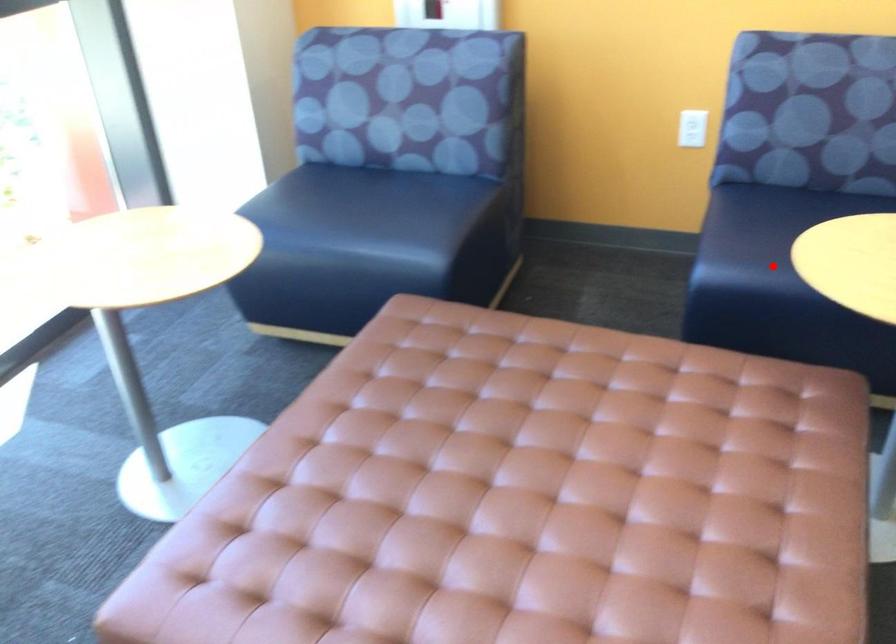
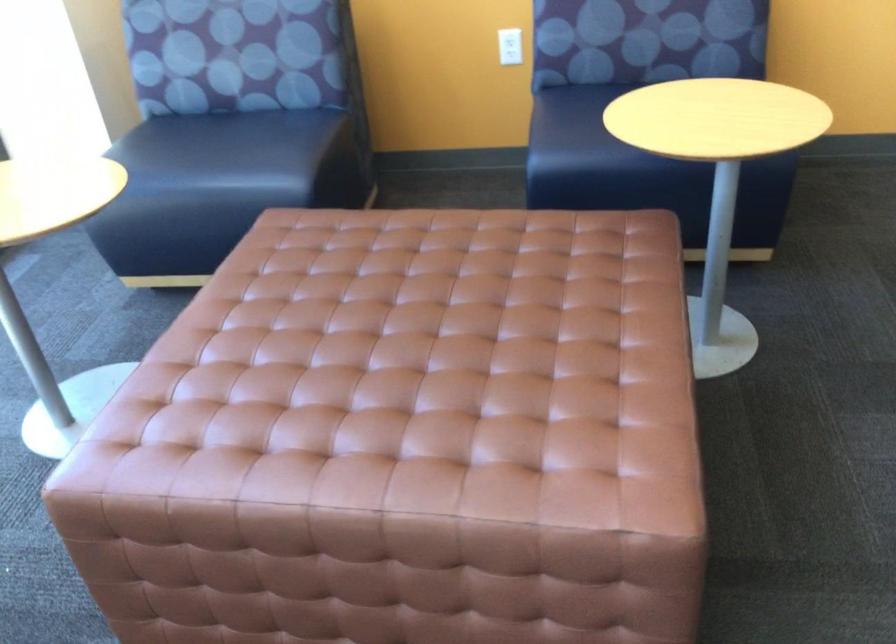
Where in the second image is the point corresponding to the highlighted location from the first image?

(593, 146)